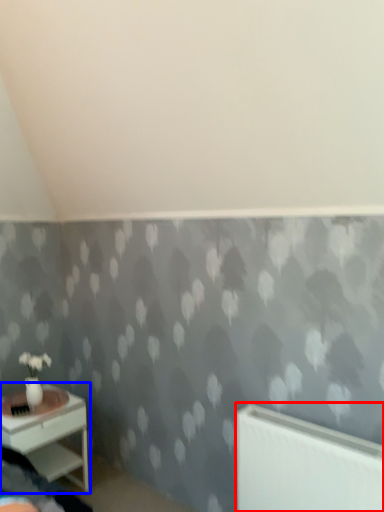
Question: Which object is further to the camera taking this photo, radiator (highlighted by a red box) or nightstand (highlighted by a blue box)?

Choices:
 (A) radiator
 (B) nightstand

Answer: (B)